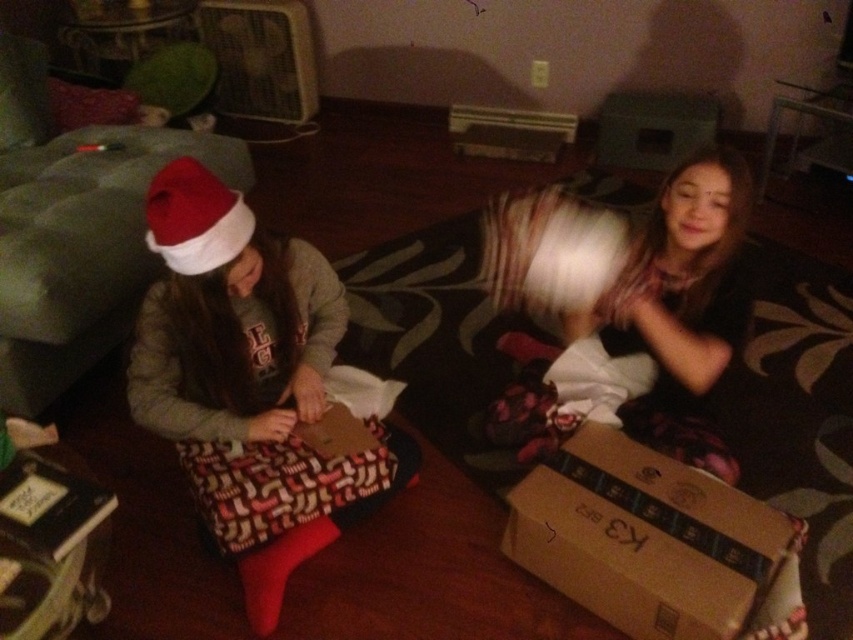
Which is behind, point (177, 310) or point (567, 529)?

The point (567, 529) is behind.

Identify the location of matte black gift at left. (248, 381).

Image resolution: width=853 pixels, height=640 pixels. What do you see at coordinates (248, 381) in the screenshot? I see `matte black gift at left` at bounding box center [248, 381].

This screenshot has width=853, height=640. I want to click on matte black gift at left, so click(x=248, y=381).

Is matte black gift at left bigger than red velvet santa hat at left?

Yes, matte black gift at left is bigger than red velvet santa hat at left.

Where is `matte black gift at left`? This screenshot has height=640, width=853. matte black gift at left is located at coordinates (248, 381).

I want to click on matte black gift at left, so click(x=248, y=381).

Identify the location of matte black gift at left. The image size is (853, 640). click(248, 381).

Can you confirm if brown cardboard box at lower right is wider than red velvet santa hat at left?

Yes, brown cardboard box at lower right is wider than red velvet santa hat at left.

Can you confirm if brown cardboard box at lower right is bigger than red velvet santa hat at left?

Yes.

You are a GUI agent. You are given a task and a screenshot of the screen. Output one action in this format:
    pyautogui.click(x=<x>, y=<y>)
    Task: Click on the brown cardboard box at lower right
    Image resolution: width=853 pixels, height=640 pixels.
    Given the screenshot: What is the action you would take?
    pyautogui.click(x=648, y=540)

Identify the location of brown cardboard box at lower right. (648, 540).